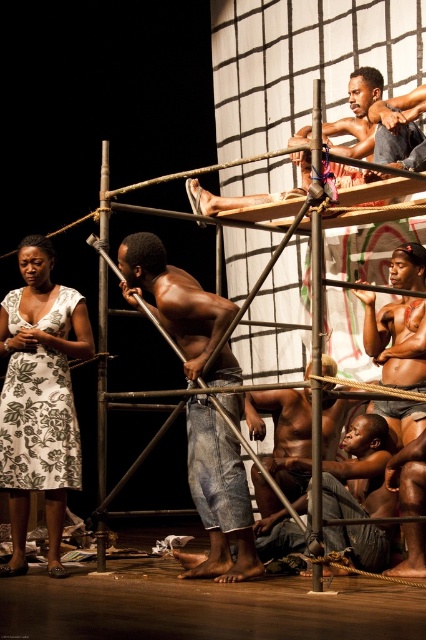
Between shiny brown skin at center and shiny metallic pole at center, which one has less height?

shiny metallic pole at center is shorter.

Does point (362, 301) come behind point (296, 451)?

Yes, point (362, 301) is behind point (296, 451).

You are a GUI agent. You are given a task and a screenshot of the screen. Output one action in this format:
    pyautogui.click(x=<x>, y=<y>)
    Task: Click on the shiny brown skin at center
    
    Given the screenshot: What is the action you would take?
    pyautogui.click(x=396, y=339)

Describe the element at coordinates (218, 496) in the screenshot. I see `denim jeans at center` at that location.

Which is more to the right, denim jeans at center or shiny metallic pole at center?

From the viewer's perspective, shiny metallic pole at center appears more on the right side.

Between point (187, 570) and point (264, 404), which one is positioned in front?

Point (187, 570)

Image resolution: width=426 pixels, height=640 pixels. Find the location of `denim jeans at center`. denim jeans at center is located at coordinates (218, 496).

Based on the photo, which is below, shiny brown skin at center or shiny metallic chain at upper center?

shiny brown skin at center is lower down.

In the scene shown: Is shiny brown skin at center below shiny metallic chain at upper center?

Yes, shiny brown skin at center is below shiny metallic chain at upper center.

Which is in front, point (414, 387) or point (204, 189)?

Point (414, 387) is more forward.

You are a GUI agent. You are given a task and a screenshot of the screen. Output one action in this format:
    pyautogui.click(x=<x>, y=<y>)
    Task: Click on the shiny brown skin at center
    Image resolution: width=426 pixels, height=640 pixels.
    Given the screenshot: What is the action you would take?
    pyautogui.click(x=396, y=339)